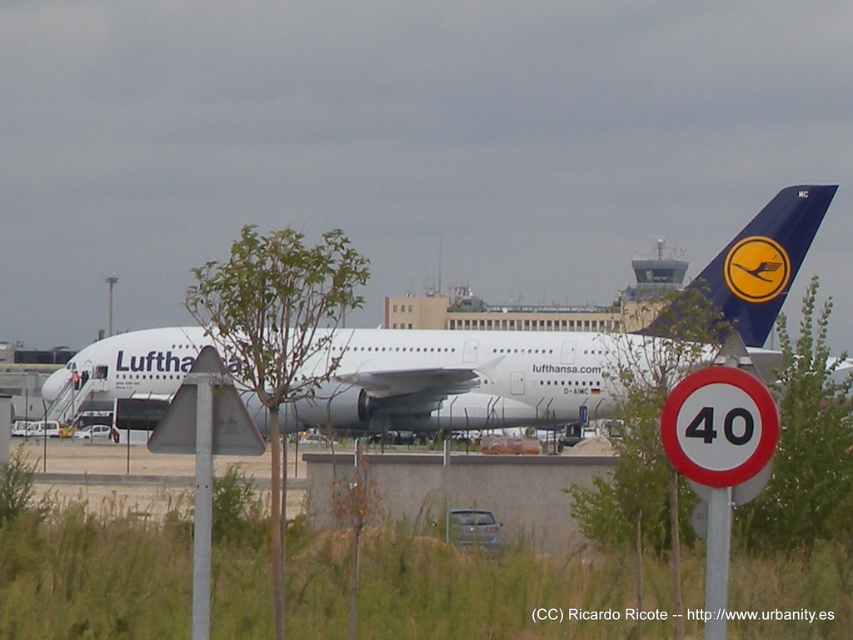
Which is above, white metallic airplane at center or white circular sign with black number at center at right?

white metallic airplane at center

Does white metallic airplane at center have a lesser width compared to white circular sign with black number at center at right?

Incorrect, white metallic airplane at center's width is not less than white circular sign with black number at center at right's.

I want to click on white metallic airplane at center, so click(x=473, y=378).

At what (x,y) coordinates should I click in order to perform the action: click on white metallic airplane at center. Please return your answer as a coordinate pair (x, y). The image size is (853, 640). Looking at the image, I should click on (473, 378).

Is red plastic speed limit sign at center positioned behind white circular sign with black number at center at right?

That is True.

Does red plastic speed limit sign at center appear over white circular sign with black number at center at right?

Actually, red plastic speed limit sign at center is below white circular sign with black number at center at right.

Does point (724, 589) come farther from viewer compared to point (758, 440)?

Yes, point (724, 589) is behind point (758, 440).

Find the location of a particular element. Image resolution: width=853 pixels, height=640 pixels. red plastic speed limit sign at center is located at coordinates (718, 456).

Is point (724, 397) positioned behind point (236, 428)?

No.

Who is shorter, red plastic speed limit sign at center or metallic triangular sign at center-left?

red plastic speed limit sign at center

Between point (694, 435) and point (236, 419), which one is positioned in front?

Point (694, 435)

The image size is (853, 640). Find the location of `red plastic speed limit sign at center`. red plastic speed limit sign at center is located at coordinates (718, 456).